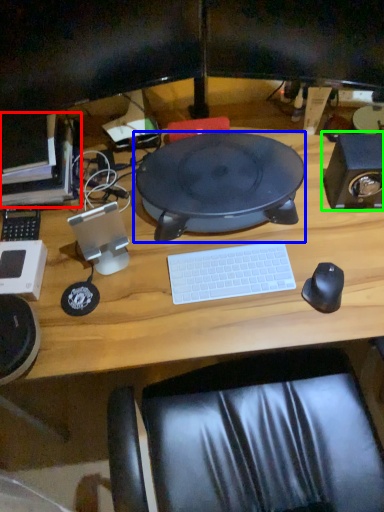
Question: Considering the real-world distances, which object is closest to computer (highlighted by a red box)? sit (highlighted by a blue box) or speaker (highlighted by a green box).

Choices:
 (A) sit
 (B) speaker

Answer: (A)